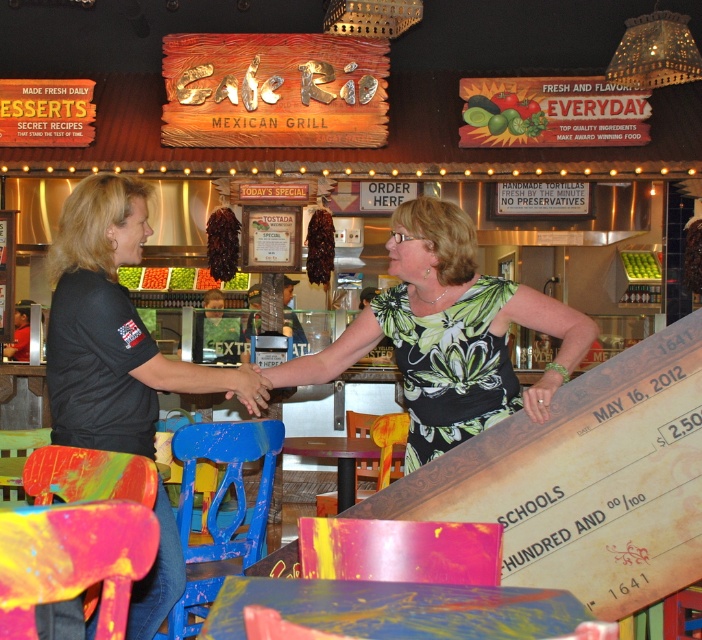
Is green floral dress at center smaller than black matte shirt at left?

Correct, green floral dress at center occupies less space than black matte shirt at left.

The width and height of the screenshot is (702, 640). What do you see at coordinates (449, 333) in the screenshot?
I see `green floral dress at center` at bounding box center [449, 333].

I want to click on green floral dress at center, so click(x=449, y=333).

The image size is (702, 640). In order to click on green floral dress at center in this screenshot , I will do `click(449, 333)`.